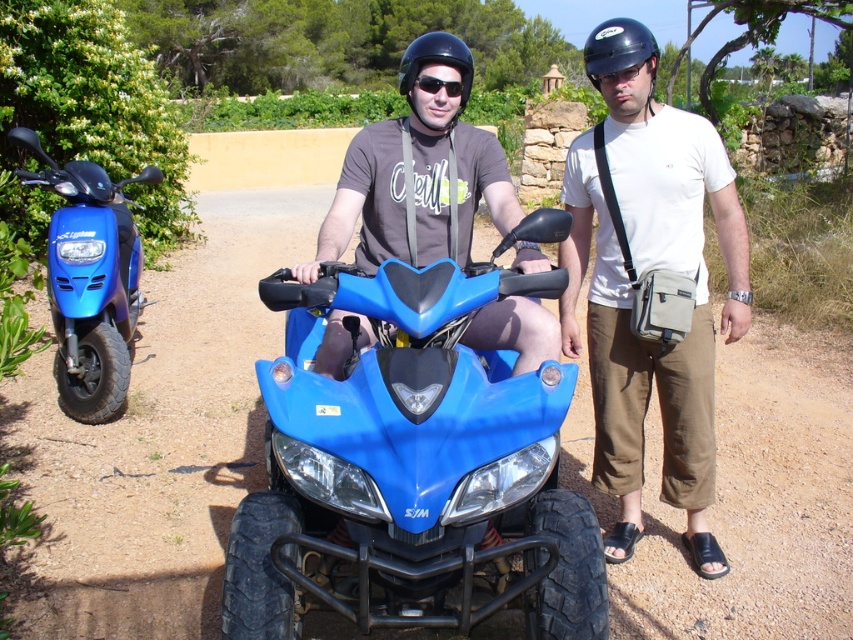
Question: Which point is farther to the camera?

Choices:
 (A) (634, 52)
 (B) (407, 61)
 (C) (529, 461)
 (D) (715, 189)

Answer: (D)

Question: Does blue glossy scooter at left have a greater width compared to transparent plastic goggles at center?

Choices:
 (A) no
 (B) yes

Answer: (B)

Question: Which point appears closest to the camera in this image?

Choices:
 (A) (500, 204)
 (B) (614, 54)
 (C) (115, 182)
 (D) (399, 65)

Answer: (A)

Question: Is blue glossy scooter at left in front of black matte helmet at center?

Choices:
 (A) yes
 (B) no

Answer: (B)

Question: Which of the following is the closest to the observer?

Choices:
 (A) (436, 83)
 (B) (529, 324)
 (C) (103, 387)

Answer: (B)

Question: Is blue glossy quad bike at center smaller than matte black helmet at center?

Choices:
 (A) yes
 (B) no

Answer: (B)